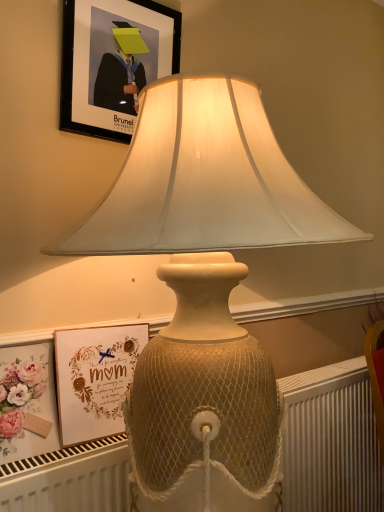
Question: Is matte gold picture frame at lower left, the first picture frame from the bottom, bigger or smaller than black matte picture frame at upper center, the first picture frame in the top-to-bottom sequence?

Choices:
 (A) small
 (B) big

Answer: (B)

Question: In terms of width, does matte gold picture frame at lower left, the first picture frame from the bottom, look wider or thinner when compared to black matte picture frame at upper center, the first picture frame in the top-to-bottom sequence?

Choices:
 (A) thin
 (B) wide

Answer: (B)

Question: Estimate the real-world distances between objects in this image. Which object is farther from the black matte picture frame at upper center, the first picture frame in the top-to-bottom sequence?

Choices:
 (A) matte gold picture frame at lower left, positioned as the 2th picture frame in top-to-bottom order
 (B) white textured radiator at lower center

Answer: (B)

Question: Estimate the real-world distances between objects in this image. Which object is closer to the white textured radiator at lower center?

Choices:
 (A) matte gold picture frame at lower left, the first picture frame from the bottom
 (B) black matte picture frame at upper center, the first picture frame in the top-to-bottom sequence

Answer: (A)